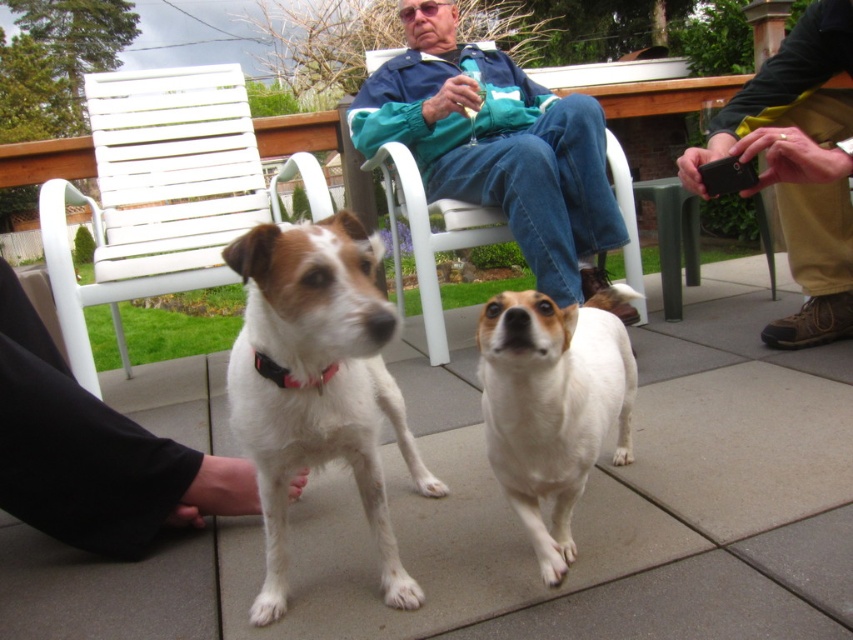
You are a photographer standing on the patio and want to take a photo of the white fur dog at center without including the white fabric pants at lower left in the frame. Is this possible based on their positions?

The white fabric pants at lower left is below the white fur dog at center, so if you position yourself to aim the camera upwards or adjust the angle to exclude the lower area where the pants are located, you can capture the white fur dog at center without including the white fabric pants at lower left in the frame.

You are a photographer trying to capture a clear shot of the white fur dog at center without any obstructions. Given that the white fabric pants at lower left are in the way, can you adjust your position to avoid them?

The white fur dog at center is behind the white fabric pants at lower left, so moving your camera position lower or to the side might allow you to capture the dog without the pants obstructing the view.

Based on the photo, you are a photographer setting up equipment in the scene. You need to place a tripod between the white matte dog at center and the white plastic chair at left. Which object should the tripod be closer to if it must be positioned closer to the smaller object?

The white matte dog at center is smaller than the white plastic chair at left, so the tripod should be placed closer to the white matte dog at center.